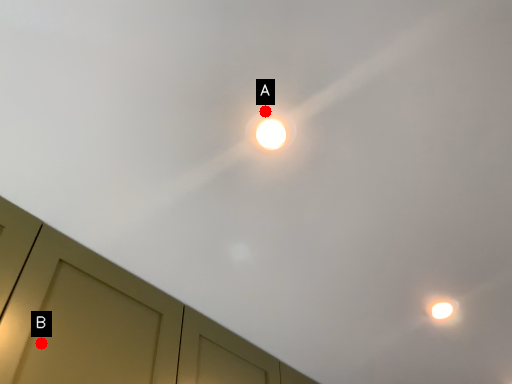
Question: Two points are circled on the image, labeled by A and B beside each circle. Which point is closer to the camera?

Choices:
 (A) A is closer
 (B) B is closer

Answer: (A)